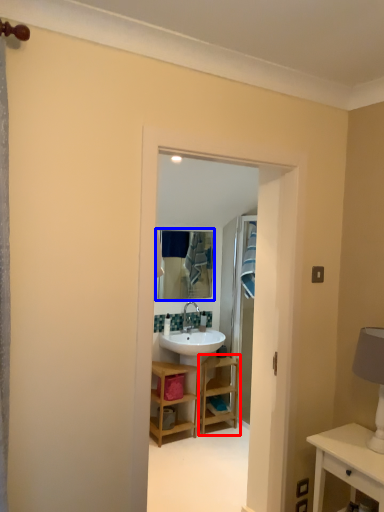
Question: Which of the following is the closest to the observer, shelf (highlighted by a red box) or mirror (highlighted by a blue box)?

Choices:
 (A) shelf
 (B) mirror

Answer: (A)